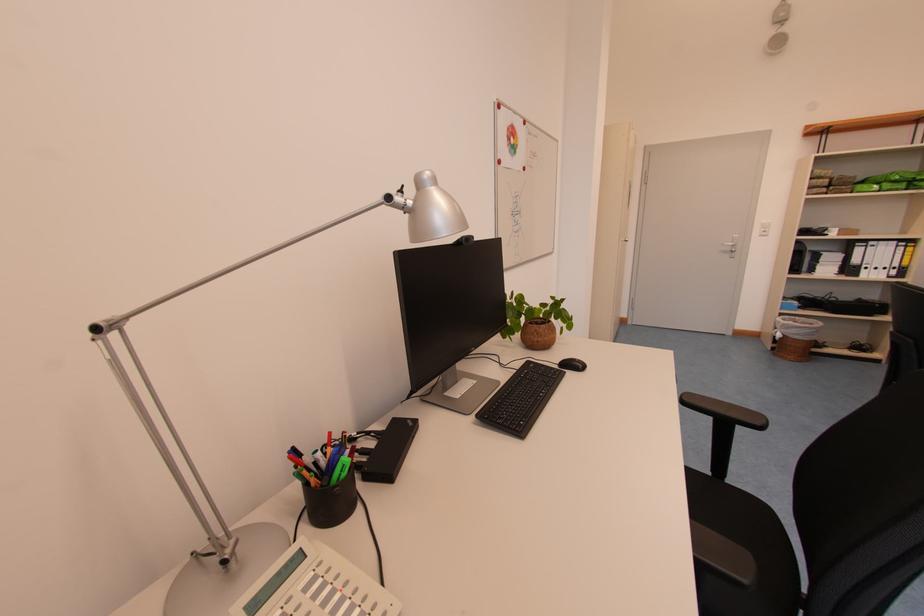
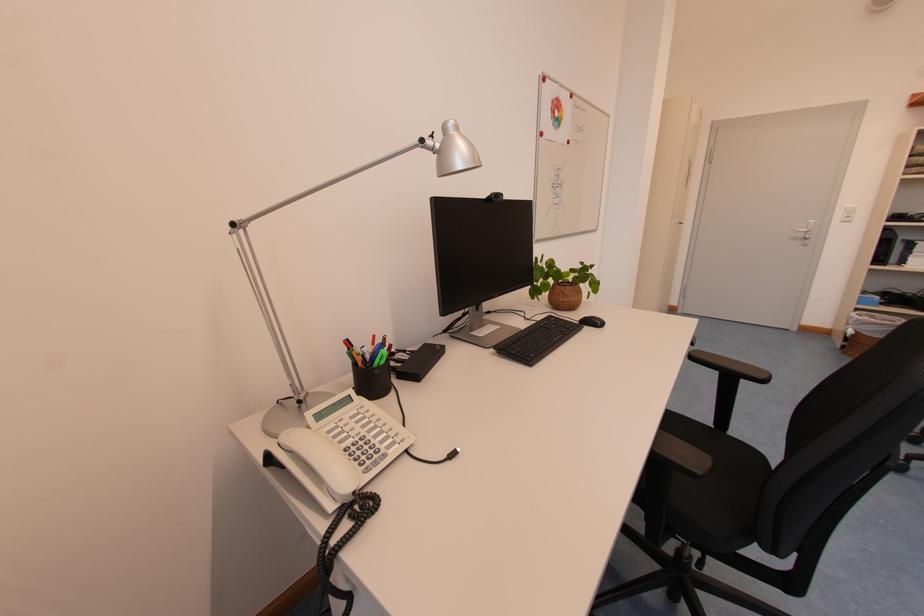
What movement of the cameraman would produce the second image?

The cameraman walked toward right, backward.